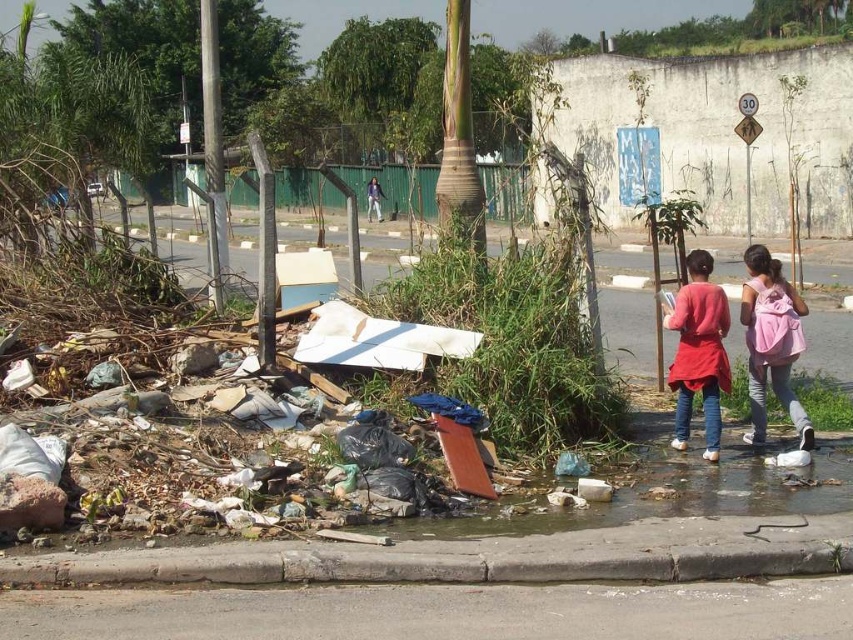
Can you confirm if pink fabric carrier at right is smaller than purple fabric at center?

Yes.

Based on the photo, is pink fabric carrier at right thinner than purple fabric at center?

Incorrect, pink fabric carrier at right's width is not less than purple fabric at center's.

Measure the distance between point (780, 333) and camera.

They are 8.15 meters apart.

This screenshot has height=640, width=853. I want to click on pink fabric carrier at right, so click(770, 340).

Does gray concrete curb at lower center appear under matte red sweater at center?

Correct, gray concrete curb at lower center is located below matte red sweater at center.

Which of these two, gray concrete curb at lower center or matte red sweater at center, stands shorter?

gray concrete curb at lower center is shorter.

Between point (494, 579) and point (689, 316), which one is positioned in front?

Positioned in front is point (494, 579).

The width and height of the screenshot is (853, 640). What are the coordinates of `gray concrete curb at lower center` in the screenshot? It's located at (419, 564).

Is gray concrete curb at lower center shorter than pink fabric carrier at right?

Correct, gray concrete curb at lower center is not as tall as pink fabric carrier at right.

Which is behind, point (788, 563) or point (776, 392)?

Positioned behind is point (776, 392).

Is point (340, 552) closer to camera compared to point (762, 365)?

Yes, point (340, 552) is in front of point (762, 365).

Locate an element on the screen. Image resolution: width=853 pixels, height=640 pixels. gray concrete curb at lower center is located at coordinates (419, 564).